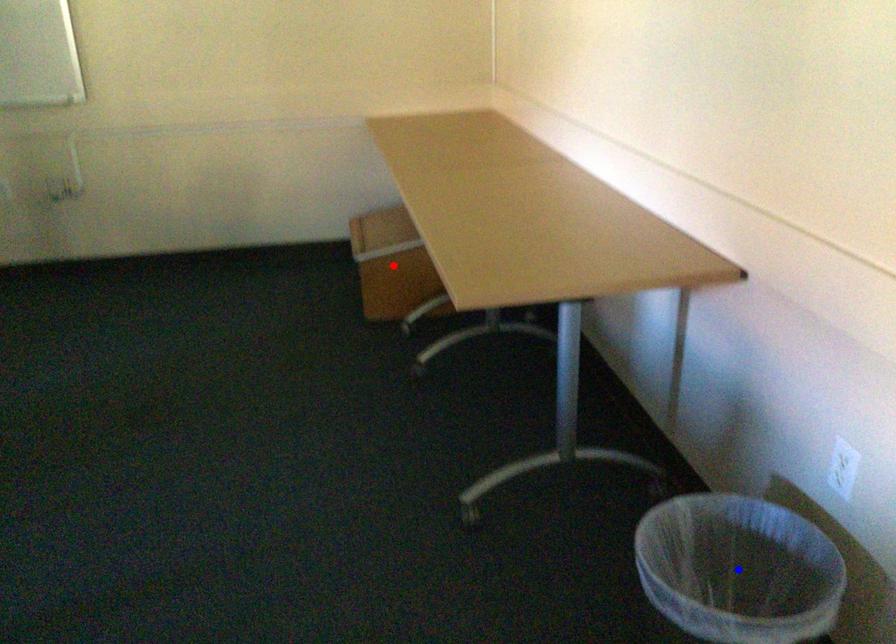
Question: Two points are marked on the image. Which point is closer to the camera?

Choices:
 (A) Blue point is closer.
 (B) Red point is closer.

Answer: (A)